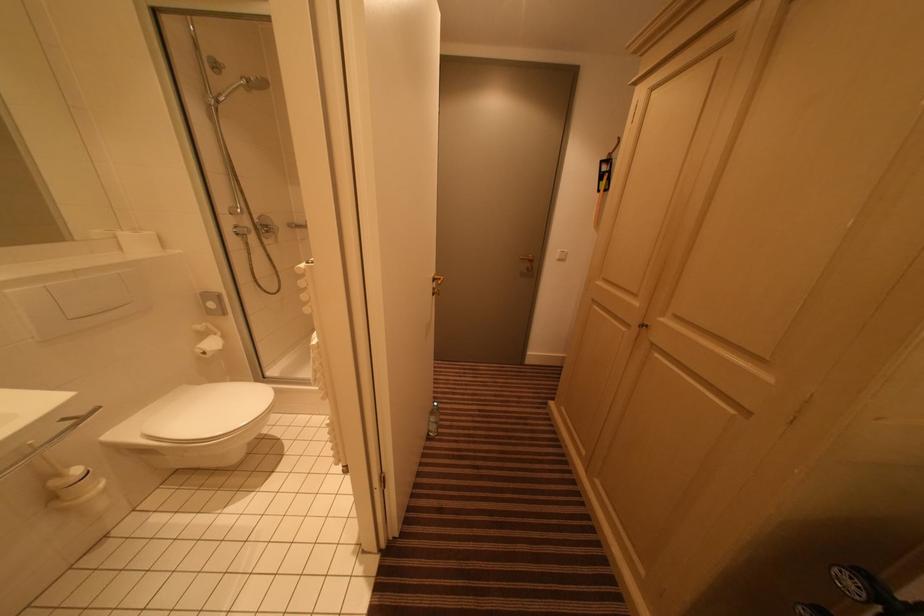
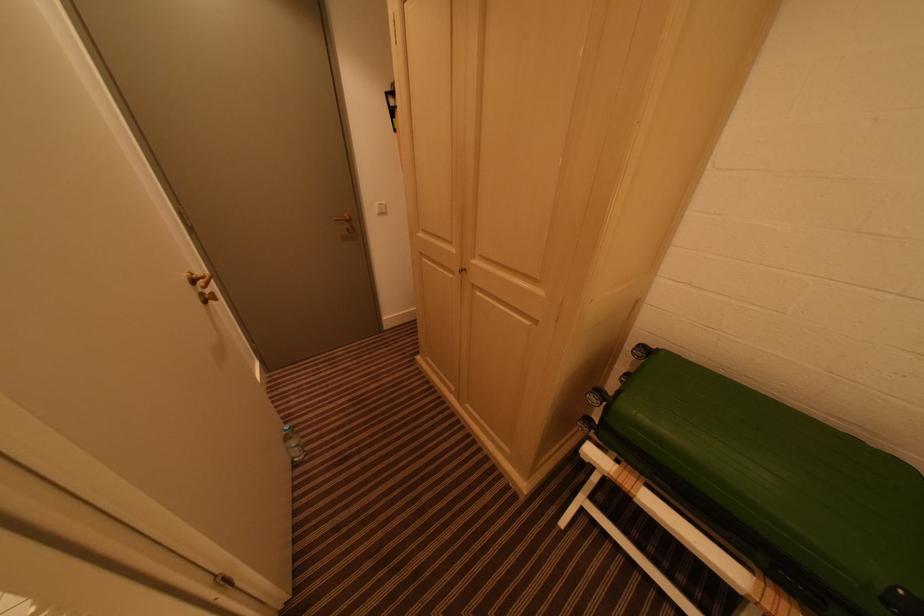
The point at (564, 260) is marked in the first image. Where is the corresponding point in the second image?

(383, 214)